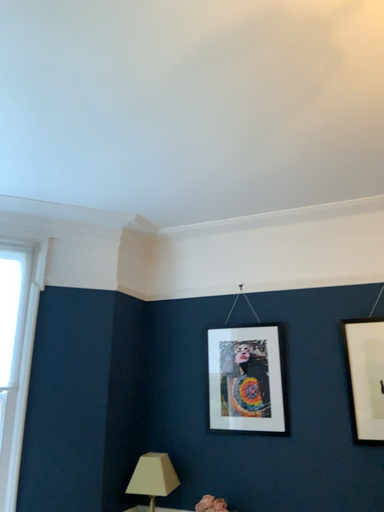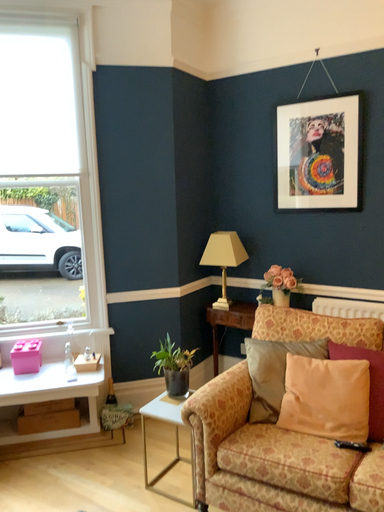
Question: Which way did the camera rotate in the video?

Choices:
 (A) rotated left
 (B) rotated right

Answer: (A)